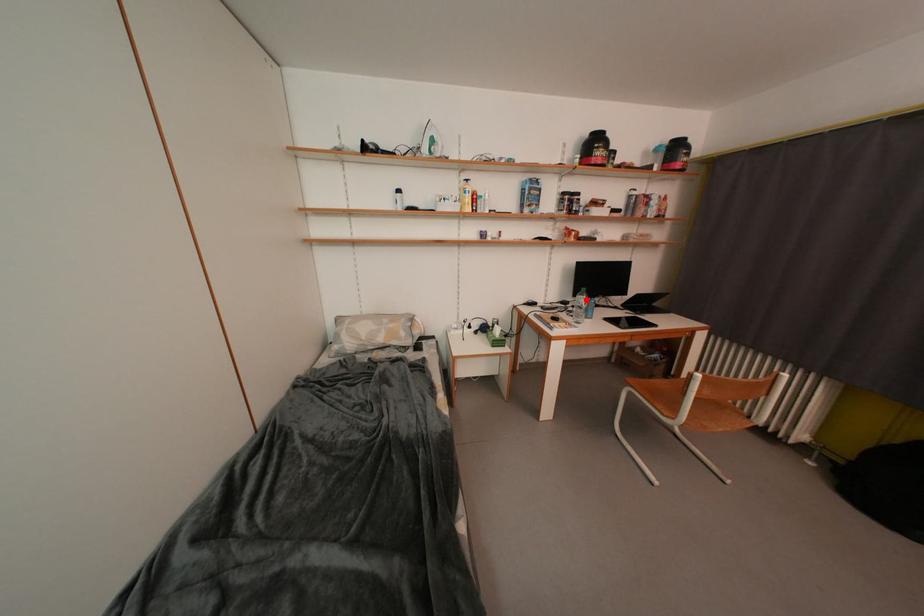
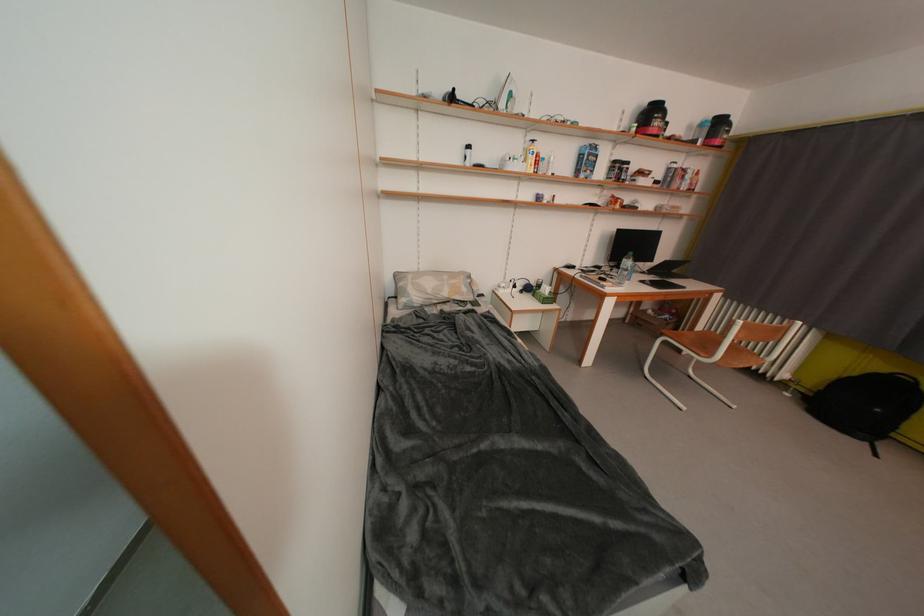
In the second image, find the point that corresponds to the highlighted location in the first image.

(631, 262)